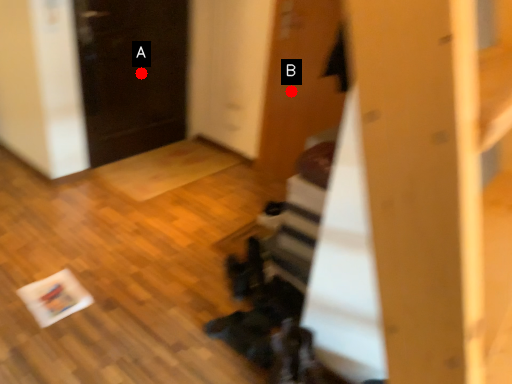
Question: Two points are circled on the image, labeled by A and B beside each circle. Among these points, which one is nearest to the camera?

Choices:
 (A) A is closer
 (B) B is closer

Answer: (B)